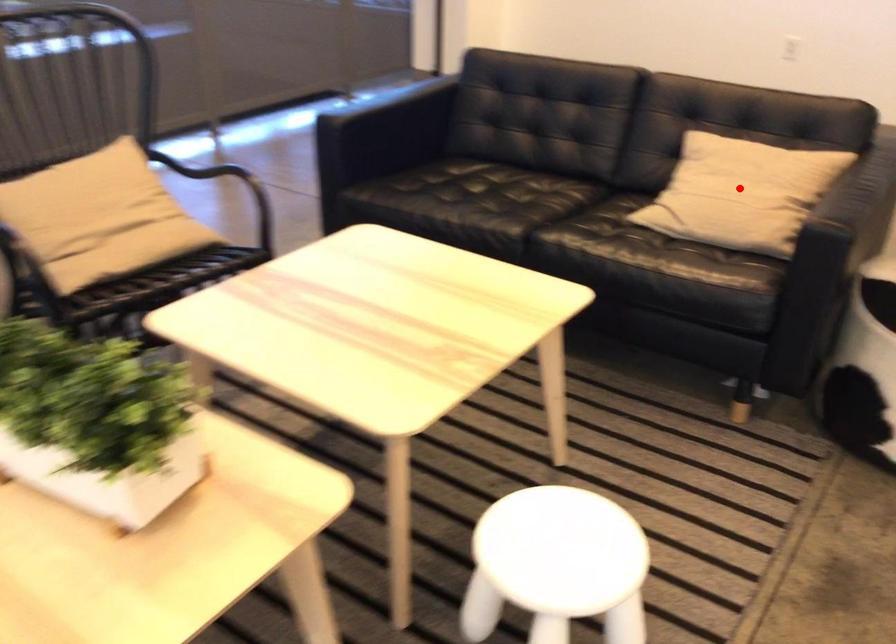
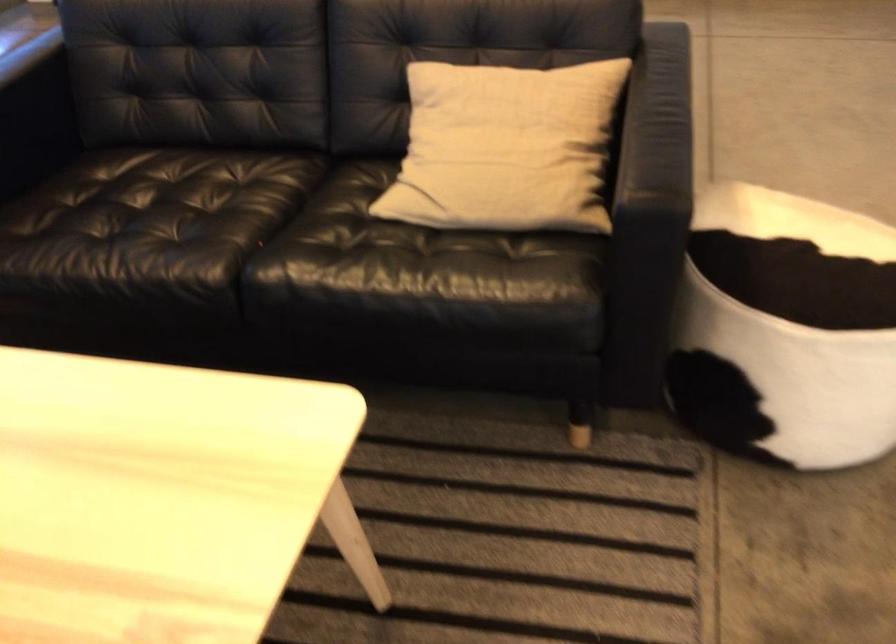
Question: I am providing you with two images of the same scene from different viewpoints. Image1 has a red point marked. In image2, the corresponding 3D location appears at what relative position? Reply with the corresponding letter.

Choices:
 (A) Closer
 (B) Farther

Answer: (A)